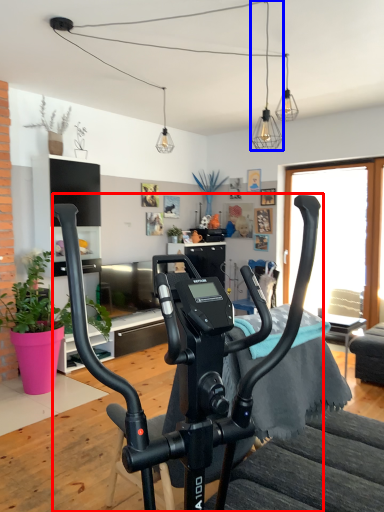
Question: Among these objects, which one is farthest to the camera, stationary bicycle (highlighted by a red box) or light fixture (highlighted by a blue box)?

Choices:
 (A) stationary bicycle
 (B) light fixture

Answer: (B)